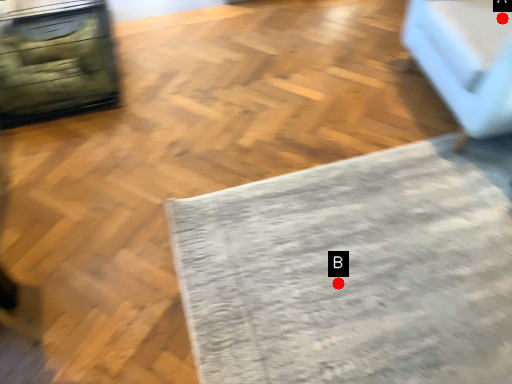
Question: Two points are circled on the image, labeled by A and B beside each circle. Which of the following is the closest to the observer?

Choices:
 (A) A is closer
 (B) B is closer

Answer: (B)